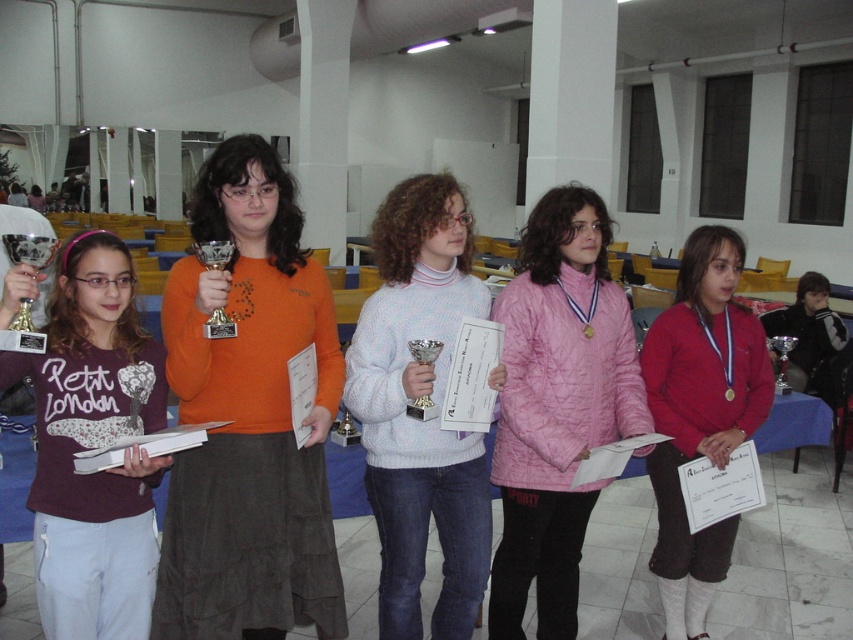
Question: Can you confirm if white knitted sweater at center is positioned to the left of matte red sweater at center?

Choices:
 (A) yes
 (B) no

Answer: (A)

Question: Does orange suede skirt at center appear under white knitted sweater at center?

Choices:
 (A) no
 (B) yes

Answer: (A)

Question: Which of the following is the closest to the observer?

Choices:
 (A) matte red sweater at center
 (B) white knitted sweater at center

Answer: (B)

Question: Is pink quilted jacket at center wider than metallic silver trophy at left?

Choices:
 (A) yes
 (B) no

Answer: (A)

Question: Which object is the closest to the orange suede skirt at center?

Choices:
 (A) pink quilted jacket at center
 (B) metallic silver trophy at left
 (C) matte purple sweatshirt at left

Answer: (C)

Question: Which object is farther from the camera taking this photo?

Choices:
 (A) white knitted sweater at center
 (B) matte purple sweatshirt at left
 (C) matte red sweater at center

Answer: (C)